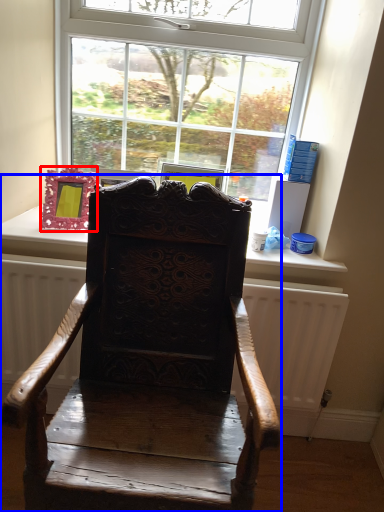
Question: Which point is further to the camera, picture frame (highlighted by a red box) or chair (highlighted by a blue box)?

Choices:
 (A) picture frame
 (B) chair

Answer: (A)